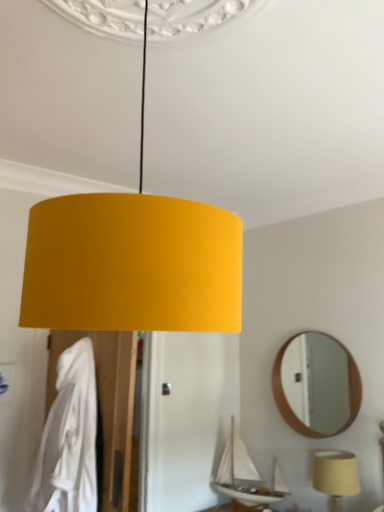
This screenshot has height=512, width=384. Describe the element at coordinates (335, 476) in the screenshot. I see `matte beige lampshade at lower right` at that location.

This screenshot has width=384, height=512. What do you see at coordinates (69, 438) in the screenshot?
I see `white fabric robe at left` at bounding box center [69, 438].

Where is `matte beige lampshade at lower right`? This screenshot has width=384, height=512. matte beige lampshade at lower right is located at coordinates (335, 476).

Which is more to the left, white matte sailboat at lower center or wooden round mirror at upper right?

Positioned to the left is white matte sailboat at lower center.

Does point (234, 444) appear closer or farther from the camera than point (302, 390)?

Point (234, 444) appears to be closer to the viewer than point (302, 390).

Measure the distance between white matte sailboat at lower center and wooden round mirror at upper right.

white matte sailboat at lower center and wooden round mirror at upper right are 3.77 feet apart.

Between white matte sailboat at lower center and wooden round mirror at upper right, which one is positioned behind?

white matte sailboat at lower center is further away from the camera.

Is matte beige lampshade at lower right taller than white fabric robe at left?

Incorrect, the height of matte beige lampshade at lower right is not larger of that of white fabric robe at left.

From a real-world perspective, is matte beige lampshade at lower right positioned above or below white fabric robe at left?

In terms of real-world spatial position, matte beige lampshade at lower right is below white fabric robe at left.

Measure the distance from matte beige lampshade at lower right to white fabric robe at left.

matte beige lampshade at lower right is 1.76 meters away from white fabric robe at left.

Does point (73, 424) appear closer or farther from the camera than point (277, 465)?

Point (73, 424) appears to be closer to the viewer than point (277, 465).

Considering the relative sizes of white fabric robe at left and white matte sailboat at lower center in the image provided, is white fabric robe at left smaller than white matte sailboat at lower center?

Incorrect, white fabric robe at left is not smaller in size than white matte sailboat at lower center.

Is white fabric robe at left aimed at white matte sailboat at lower center?

No, white fabric robe at left is not aimed at white matte sailboat at lower center.

Measure the distance from white fabric robe at left to white matte sailboat at lower center.

white fabric robe at left is 1.64 meters away from white matte sailboat at lower center.

From a real-world perspective, which is physically above, white matte sailboat at lower center or matte beige lampshade at lower right?

white matte sailboat at lower center is physically above.

From the image's perspective, between white matte sailboat at lower center and matte beige lampshade at lower right, which one is located above?

matte beige lampshade at lower right is shown above in the image.

How much distance is there between white matte sailboat at lower center and matte beige lampshade at lower right?

The distance of white matte sailboat at lower center from matte beige lampshade at lower right is 24.55 inches.

Looking at this image, can you confirm if white matte sailboat at lower center is taller than matte beige lampshade at lower right?

Yes.

Between matte beige lampshade at lower right and wooden round mirror at upper right, which one has larger width?

matte beige lampshade at lower right is wider.

From a real-world perspective, is matte beige lampshade at lower right positioned over wooden round mirror at upper right based on gravity?

No, from a real-world perspective, matte beige lampshade at lower right is not over wooden round mirror at upper right

From a real-world perspective, is white fabric robe at left on wooden round mirror at upper right?

No, from a real-world perspective, white fabric robe at left is not on top of wooden round mirror at upper right.

The height and width of the screenshot is (512, 384). Identify the location of robe on the left of wooden round mirror at upper right. (69, 438).

What's the angular difference between white fabric robe at left and wooden round mirror at upper right's facing directions?

There is a 12.2-degree angle between the facing directions of white fabric robe at left and wooden round mirror at upper right.

Is there a large distance between white fabric robe at left and wooden round mirror at upper right?

white fabric robe at left is positioned a significant distance from wooden round mirror at upper right.

Where is `lamp in front of the wooden round mirror at upper right`? The height and width of the screenshot is (512, 384). lamp in front of the wooden round mirror at upper right is located at coordinates (335, 476).

From a real-world perspective, is wooden round mirror at upper right on matte beige lampshade at lower right?

Yes, from a real-world perspective, wooden round mirror at upper right is on top of matte beige lampshade at lower right.

Who is more distant, wooden round mirror at upper right or matte beige lampshade at lower right?

wooden round mirror at upper right is further away from the camera.

Identify the location of boat that appears below the wooden round mirror at upper right (from a real-world perspective). The width and height of the screenshot is (384, 512). (246, 476).

Identify the location of robe in front of the matte beige lampshade at lower right. (69, 438).

Which object lies further to the anchor point white fabric robe at left, wooden round mirror at upper right or matte beige lampshade at lower right?

wooden round mirror at upper right lies further to white fabric robe at left than the other object.

Estimate the real-world distances between objects in this image. Which object is further from white matte sailboat at lower center, white fabric robe at left or matte beige lampshade at lower right?

The object further to white matte sailboat at lower center is white fabric robe at left.

In the scene shown: Estimate the real-world distances between objects in this image. Which object is further from white fabric robe at left, white matte sailboat at lower center or wooden round mirror at upper right?

wooden round mirror at upper right is positioned further to the anchor white fabric robe at left.

When comparing their distances from white fabric robe at left, does matte beige lampshade at lower right or white matte sailboat at lower center seem closer?

Based on the image, white matte sailboat at lower center appears to be nearer to white fabric robe at left.

Based on their spatial positions, is white fabric robe at left or matte beige lampshade at lower right further from wooden round mirror at upper right?

Based on the image, white fabric robe at left appears to be further to wooden round mirror at upper right.

Consider the image. Which object lies further to the anchor point wooden round mirror at upper right, white matte sailboat at lower center or matte beige lampshade at lower right?

matte beige lampshade at lower right lies further to wooden round mirror at upper right than the other object.

From the image, which object appears to be farther from white fabric robe at left, wooden round mirror at upper right or white matte sailboat at lower center?

wooden round mirror at upper right lies further to white fabric robe at left than the other object.

From the image, which object appears to be nearer to white matte sailboat at lower center, wooden round mirror at upper right or matte beige lampshade at lower right?

matte beige lampshade at lower right is positioned closer to the anchor white matte sailboat at lower center.

Find the location of a particular element. lamp between wooden round mirror at upper right and white matte sailboat at lower center in the vertical direction is located at coordinates (335, 476).

What are the coordinates of `mirror between white fabric robe at left and matte beige lampshade at lower right from left to right` in the screenshot? It's located at (317, 382).

Where is `boat between white fabric robe at left and wooden round mirror at upper right in the horizontal direction`? This screenshot has height=512, width=384. boat between white fabric robe at left and wooden round mirror at upper right in the horizontal direction is located at coordinates (246, 476).

You are a GUI agent. You are given a task and a screenshot of the screen. Output one action in this format:
    pyautogui.click(x=<x>, y=<y>)
    Task: Click on the boat between white fabric robe at left and matte beige lampshade at lower right from left to right
    The image size is (384, 512).
    Given the screenshot: What is the action you would take?
    pyautogui.click(x=246, y=476)